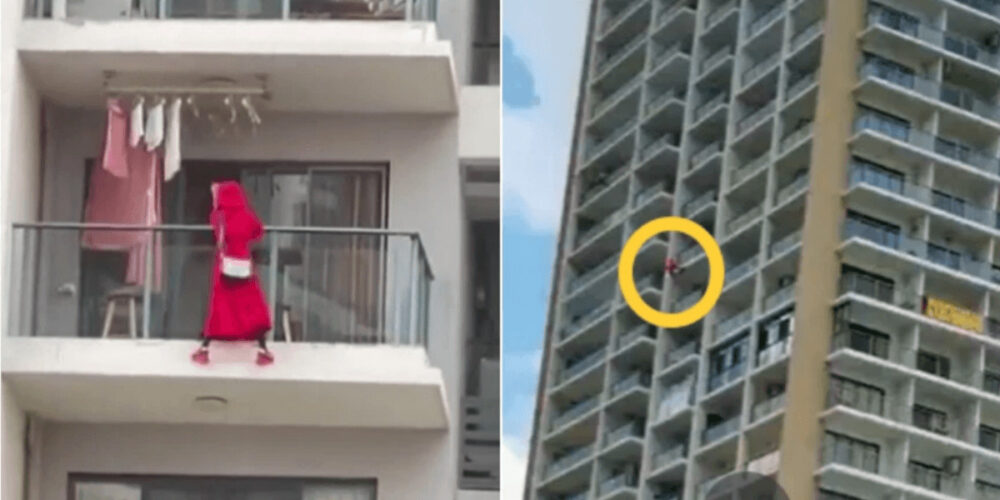
Identify the location of pink towel. (133, 198).